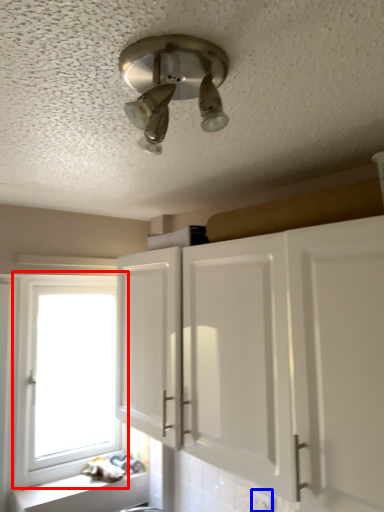
Question: Among these objects, which one is farthest to the camera, window (highlighted by a red box) or electric outlet (highlighted by a blue box)?

Choices:
 (A) window
 (B) electric outlet

Answer: (A)